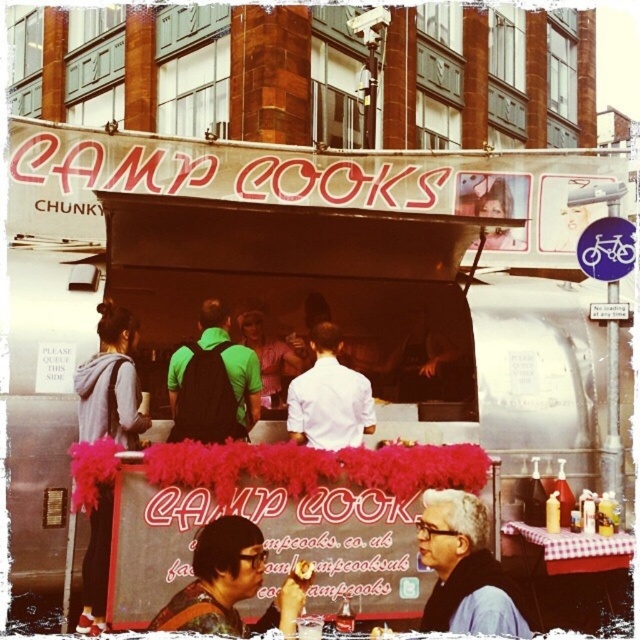
You are a customer at the Camp Cooks food truck. You notice a white shirt at center and a smooth chocolate bar at center. Which object is wider?

The white shirt at center is wider than the smooth chocolate bar at center.

You are a customer at the Camp Cooks food truck. You notice a white shirt at center and a smooth chocolate bar at center. Which item is positioned to the right?

The white shirt at center is to the right of the smooth chocolate bar at center.